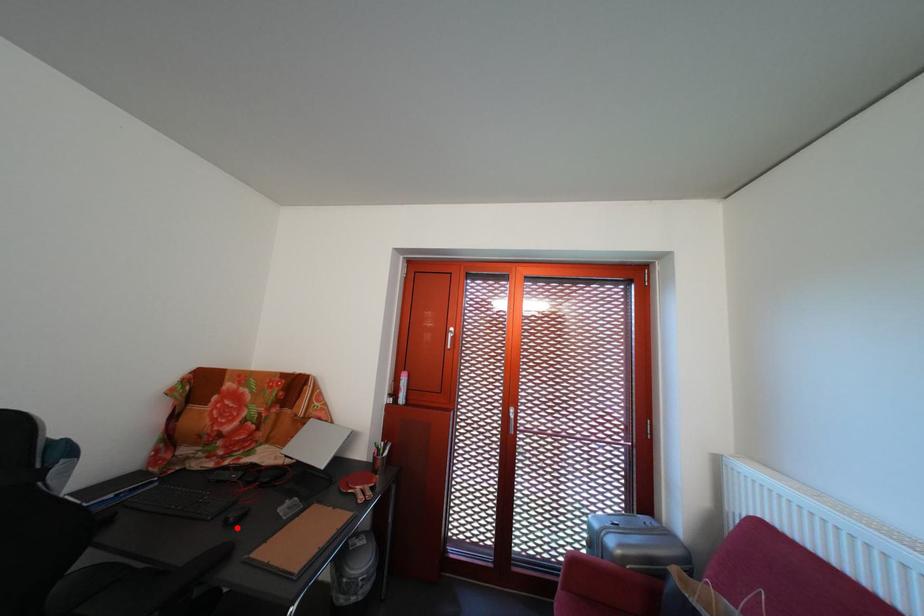
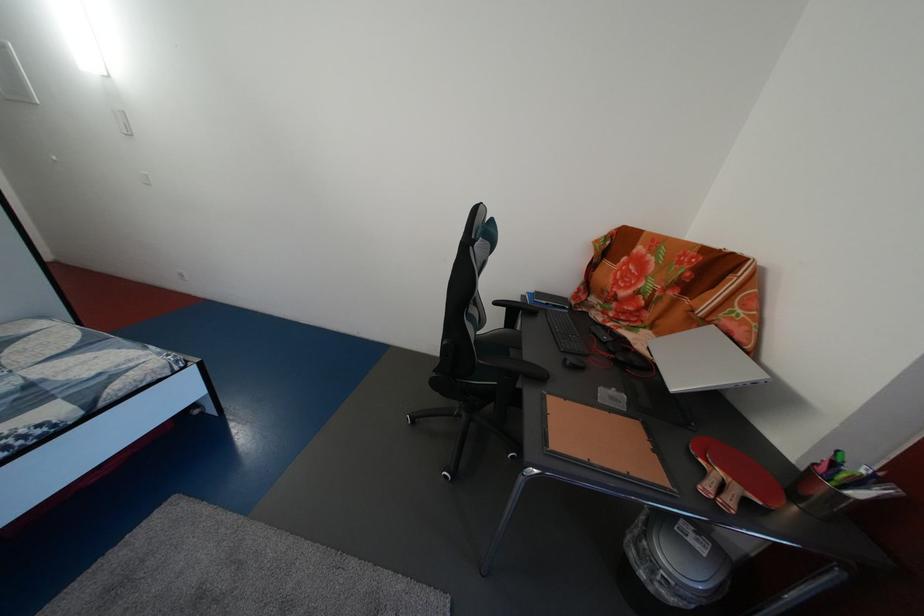
Find the pixel in the second image that matches the highlighted location in the first image.

(576, 367)